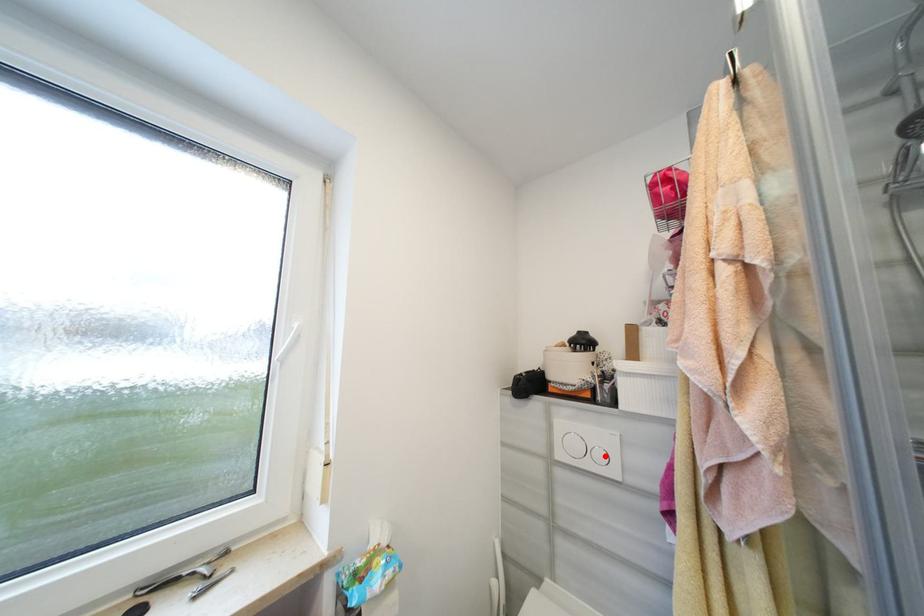
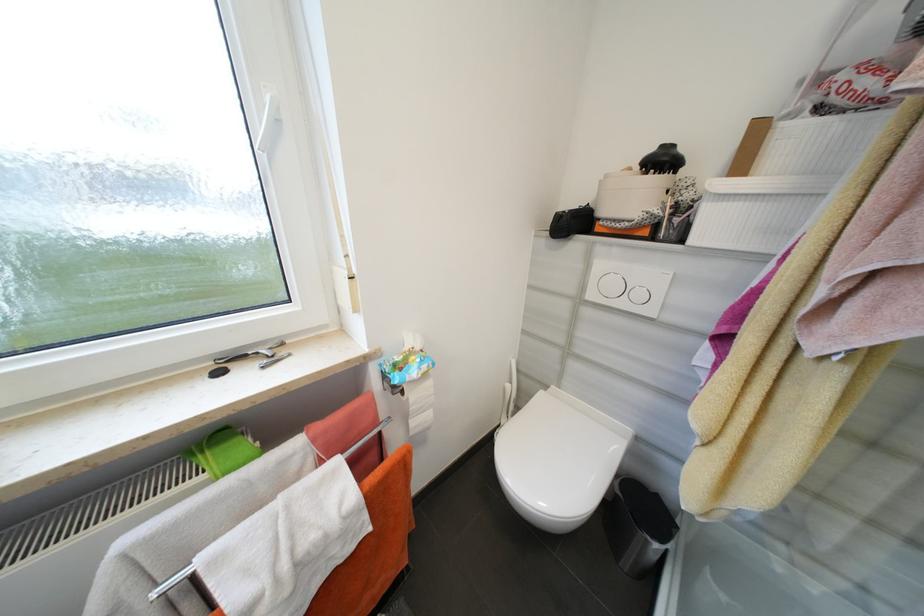
Question: I am providing you with two images of the same scene from different viewpoints. Image1 has a red point marked. In image2, the corresponding 3D location appears at what relative position? Reply with the corresponding letter.

Choices:
 (A) Closer
 (B) Farther

Answer: (A)